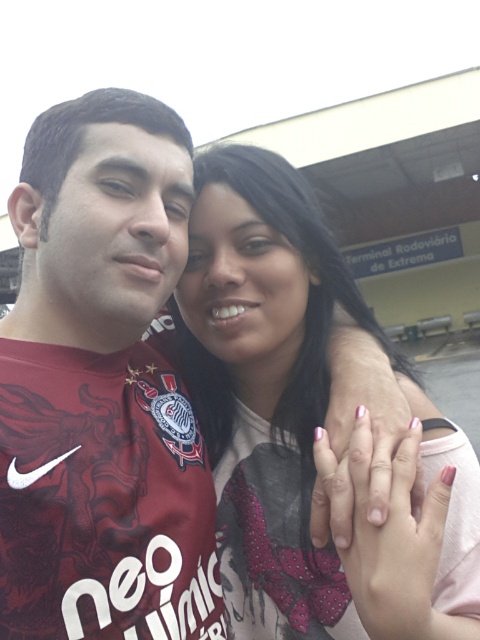
Looking at this image, you are a photographer setting up for a group photo. You notice the maroon jersey at left and the matte pink shirt at center in your frame. Which clothing item should you adjust to ensure both are visible equally in the photo?

The maroon jersey at left is taller than the matte pink shirt at center, so you should lower the maroon jersey at left to balance their heights in the photo.

You are a photographer trying to capture a clear shot of both the maroon jersey at left and the matte pink shirt at center. Based on their positions, which one is closer to the camera?

The maroon jersey at left is closer to the camera because the matte pink shirt at center is positioned behind it.

You are a photographer trying to adjust the lighting for a group photo. You notice the maroon jersey at left and the matte pink shirt at center. Which clothing item might cast a smaller shadow due to its size?

The maroon jersey at left has a smaller size compared to the matte pink shirt at center, so it would cast a smaller shadow.